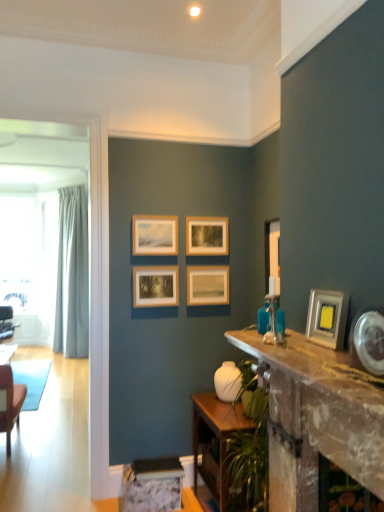
Locate an element on the screen. The width and height of the screenshot is (384, 512). vacant area in front of metallic silver picture frame at right, positioned as the 1th picture frame in front-to-back order is located at coordinates (317, 352).